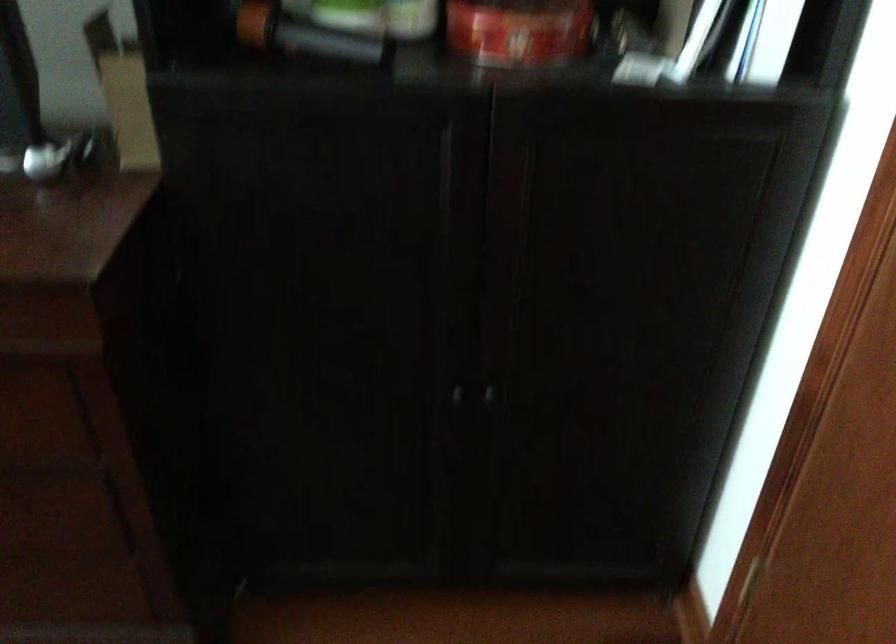
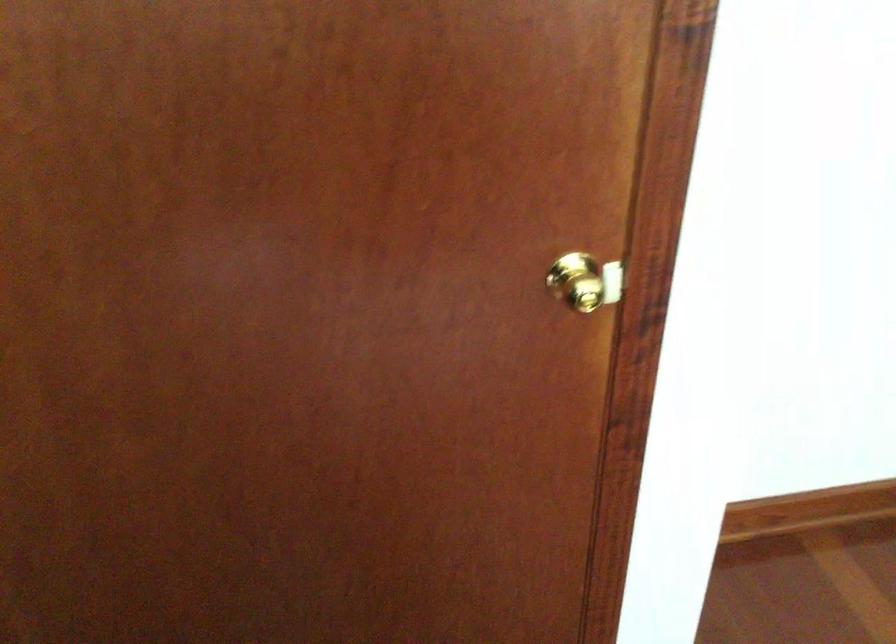
The images are taken continuously from a first-person perspective. In which direction is your viewpoint rotating?

The camera rotated toward right-down.